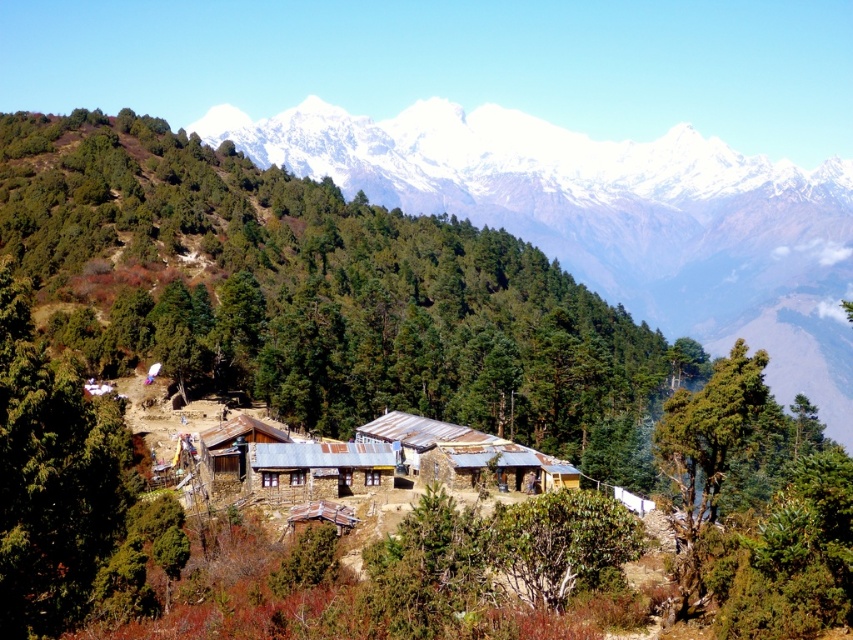
Question: Which of the following is the farthest from the observer?

Choices:
 (A) (682, 138)
 (B) (347, 483)
 (C) (291, 520)

Answer: (A)

Question: Based on their relative distances, which object is nearer to the brown wooden hut at center?

Choices:
 (A) wooden hut at center
 (B) snowy white mountain range at upper center

Answer: (A)

Question: Considering the relative positions of snowy white mountain range at upper center and wooden hut at center in the image provided, where is snowy white mountain range at upper center located with respect to wooden hut at center?

Choices:
 (A) below
 (B) above

Answer: (B)

Question: Which point is closer to the camera?

Choices:
 (A) (560, 236)
 (B) (318, 472)
 (C) (231, 476)
 (D) (289, 515)

Answer: (D)

Question: Is snowy white mountain range at upper center further to camera compared to wooden hut at center?

Choices:
 (A) yes
 (B) no

Answer: (A)

Question: Does brown stone hut at center appear on the right side of wooden hut at center?

Choices:
 (A) no
 (B) yes

Answer: (A)